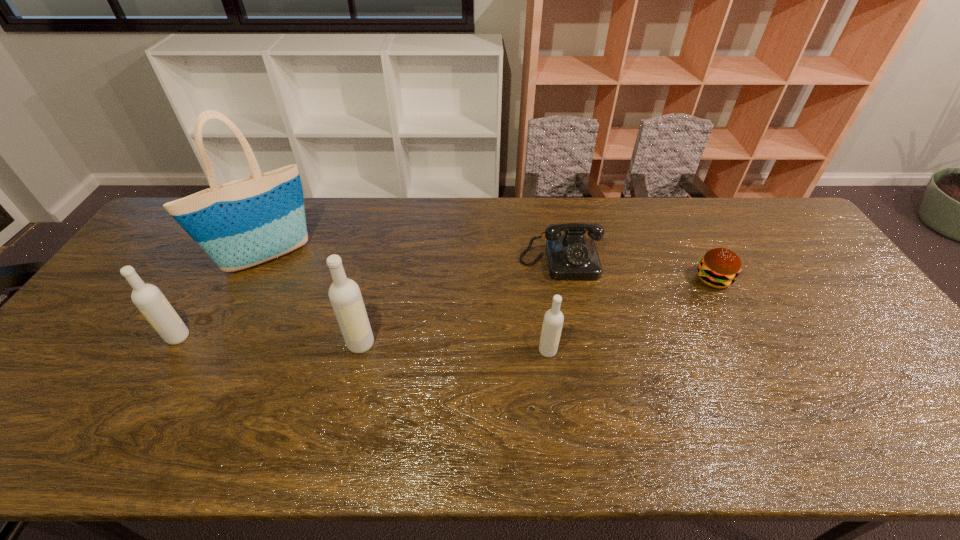
In the current image, all vodkas are evenly spaced. To maintain this equal spacing, where should an additional vodka be placed on the right? Please point out a free spot. Please provide its 2D coordinates. Your answer should be formatted as a tuple, i.e. [(x, y)], where the tuple contains the x and y coordinates of a point satisfying the conditions above.

[(740, 358)]